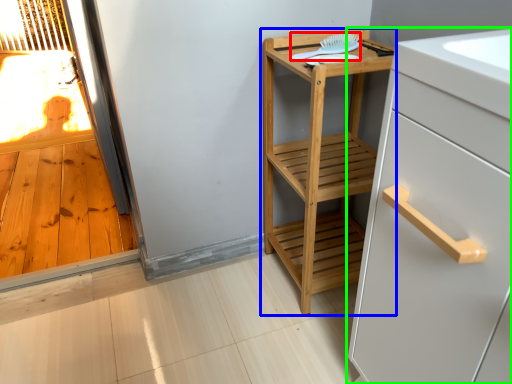
Question: Which object is positioned closest to brush (highlighted by a red box)? Select from furniture (highlighted by a blue box) and cabinetry (highlighted by a green box).

Choices:
 (A) furniture
 (B) cabinetry

Answer: (A)